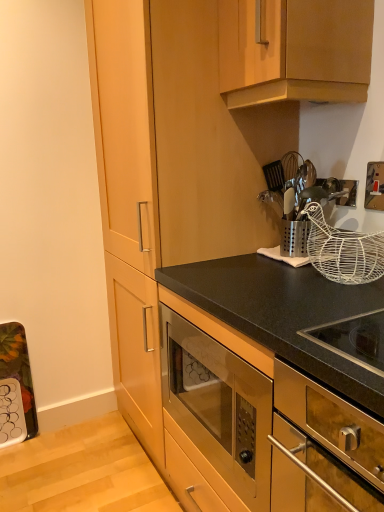
Question: Can we say stainless steel oven at lower right lies outside white wire basket at upper right?

Choices:
 (A) yes
 (B) no

Answer: (A)

Question: Does stainless steel oven at lower right appear on the right side of white wire basket at upper right?

Choices:
 (A) yes
 (B) no

Answer: (B)

Question: Is stainless steel oven at lower right facing towards white wire basket at upper right?

Choices:
 (A) yes
 (B) no

Answer: (B)

Question: Does stainless steel oven at lower right lie in front of white wire basket at upper right?

Choices:
 (A) no
 (B) yes

Answer: (B)

Question: Is stainless steel oven at lower right not close to white wire basket at upper right?

Choices:
 (A) no
 (B) yes

Answer: (A)

Question: Is stainless steel oven at lower right turned away from white wire basket at upper right?

Choices:
 (A) yes
 (B) no

Answer: (B)

Question: Does metallic silver utensil holder at upper right appear on the left side of white wire basket at upper right?

Choices:
 (A) no
 (B) yes

Answer: (B)

Question: Does metallic silver utensil holder at upper right have a lesser height compared to white wire basket at upper right?

Choices:
 (A) yes
 (B) no

Answer: (B)

Question: From the image's perspective, is metallic silver utensil holder at upper right above white wire basket at upper right?

Choices:
 (A) no
 (B) yes

Answer: (B)

Question: From a real-world perspective, is metallic silver utensil holder at upper right on top of white wire basket at upper right?

Choices:
 (A) no
 (B) yes

Answer: (B)

Question: Is the surface of metallic silver utensil holder at upper right in direct contact with white wire basket at upper right?

Choices:
 (A) no
 (B) yes

Answer: (A)

Question: Is metallic silver utensil holder at upper right turned away from white wire basket at upper right?

Choices:
 (A) yes
 (B) no

Answer: (B)

Question: Is wooden cabinet at upper center, the 2th cabinetry ordered from the bottom, a part of gold metallic switch at upper right?

Choices:
 (A) yes
 (B) no

Answer: (B)